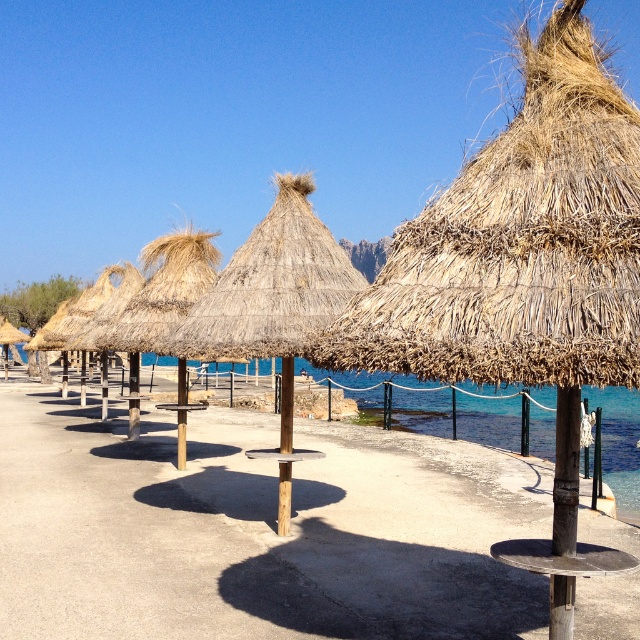
Question: Is natural straw umbrella at center behind brown wood pole at center?

Choices:
 (A) yes
 (B) no

Answer: (A)

Question: Which point is farther to the camera?

Choices:
 (A) brown wooden path at center
 (B) natural straw umbrella at center
 (C) brown wood pole at center

Answer: (A)

Question: Which point appears farthest from the camera in this image?

Choices:
 (A) (282, 211)
 (B) (300, 586)
 (C) (552, 540)

Answer: (A)

Question: Which point is farther to the camera?

Choices:
 (A) (552, 595)
 (B) (234, 596)

Answer: (B)

Question: Is brown wooden path at center smaller than natural straw umbrella at center?

Choices:
 (A) yes
 (B) no

Answer: (B)

Question: Is brown wooden path at center closer to camera compared to natural straw umbrella at center?

Choices:
 (A) no
 (B) yes

Answer: (A)